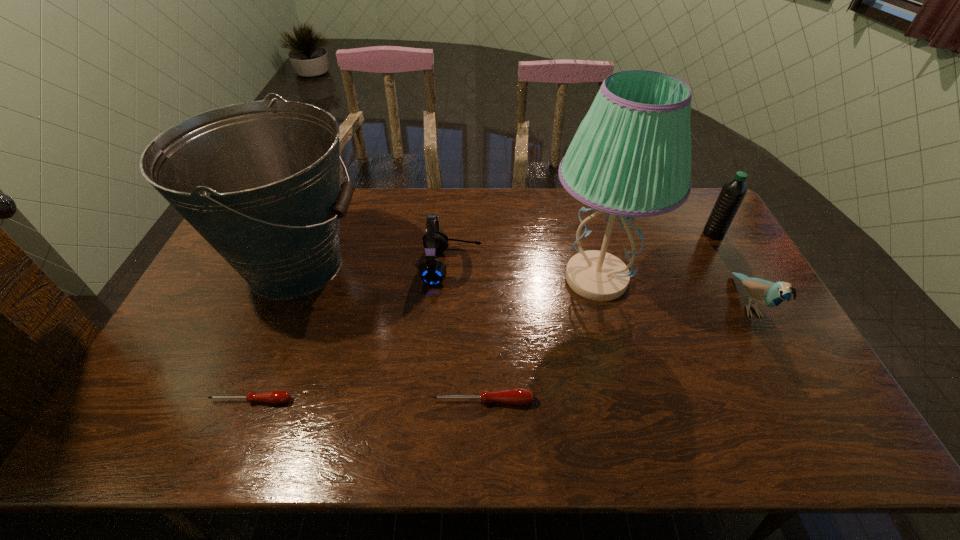
Find the location of `blank area located 0.290m on the back of the left screwdriver`. blank area located 0.290m on the back of the left screwdriver is located at coordinates (289, 306).

At what (x,y) coordinates should I click in order to perform the action: click on vacant space located 0.120m on the right of the taller screwdriver. Please return your answer as a coordinate pair (x, y). Looking at the image, I should click on (582, 401).

Image resolution: width=960 pixels, height=540 pixels. I want to click on vacant area located 0.220m on the front of the water bottle, so click(x=744, y=288).

Identify the location of vacant space located 0.280m on the ear cushions of the headset. (569, 266).

Where is `vacant area located with the handle on opposite sides of the bucket`? Image resolution: width=960 pixels, height=540 pixels. vacant area located with the handle on opposite sides of the bucket is located at coordinates (427, 265).

Where is `free space located at the face of the bird`? Image resolution: width=960 pixels, height=540 pixels. free space located at the face of the bird is located at coordinates (775, 353).

What are the coordinates of `vacant region located on the right of the fifth object from left to right` in the screenshot? It's located at click(709, 279).

Find the location of a particular element. Image resolution: width=960 pixels, height=540 pixels. water bottle present at the far edge is located at coordinates (733, 192).

This screenshot has height=540, width=960. I want to click on bucket present at the far edge, so click(260, 181).

This screenshot has height=540, width=960. Identify the location of object that is at the left edge. point(260,181).